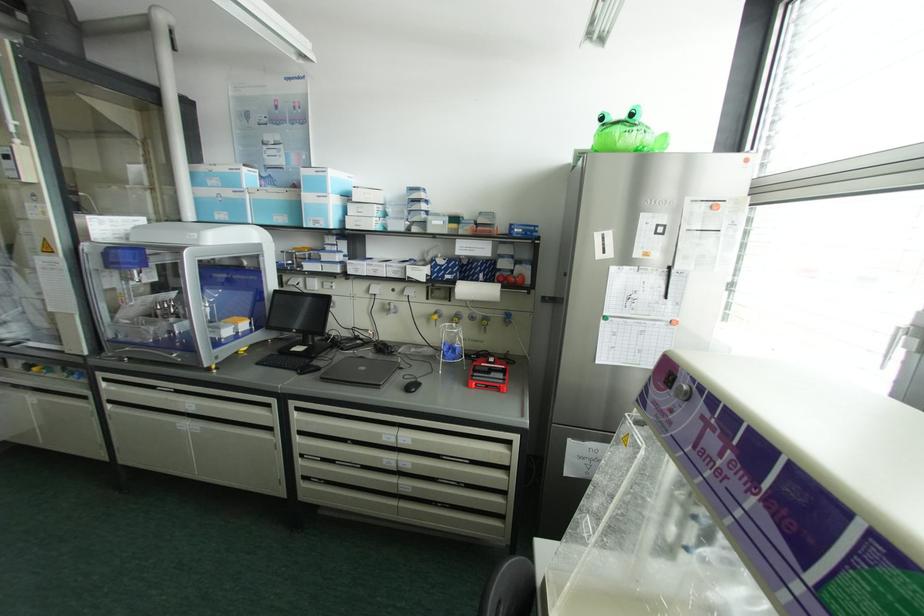
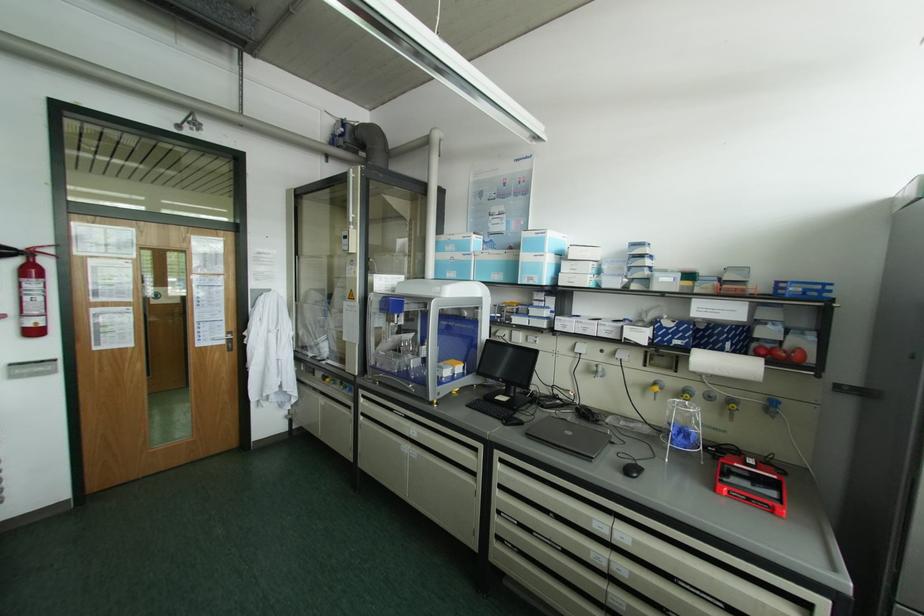
The point at (410, 387) is marked in the first image. Where is the corresponding point in the second image?

(630, 469)